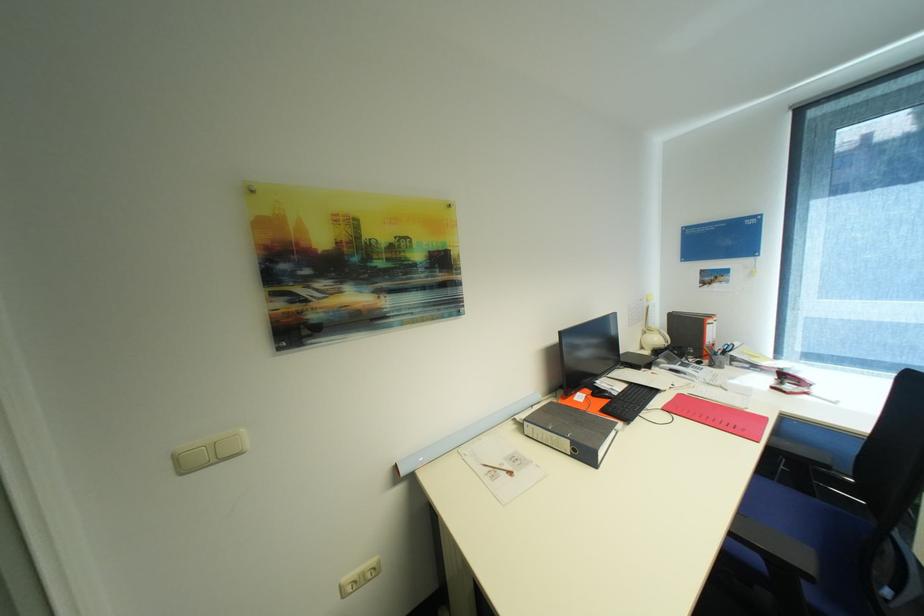
Where is `chair armrest`? The width and height of the screenshot is (924, 616). chair armrest is located at coordinates (774, 546).